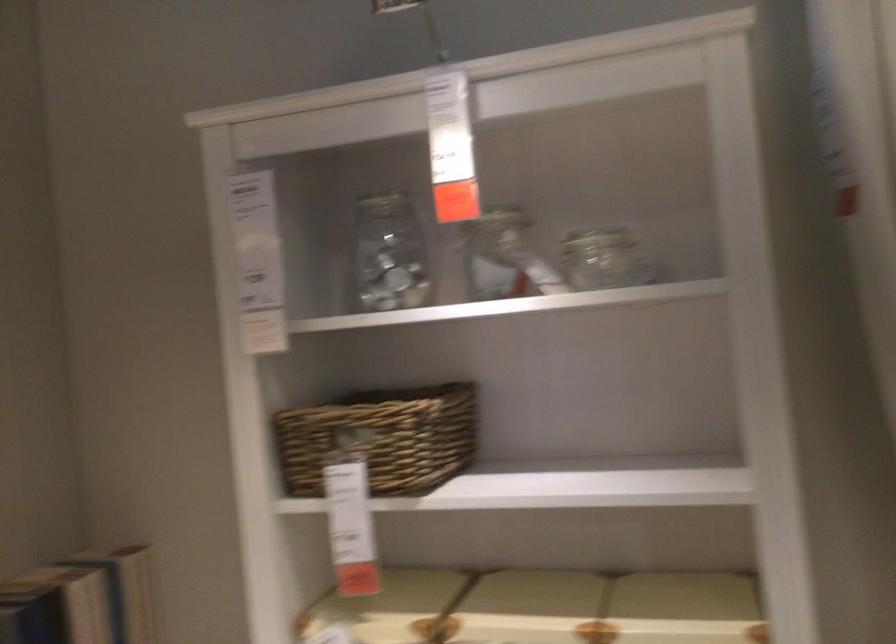
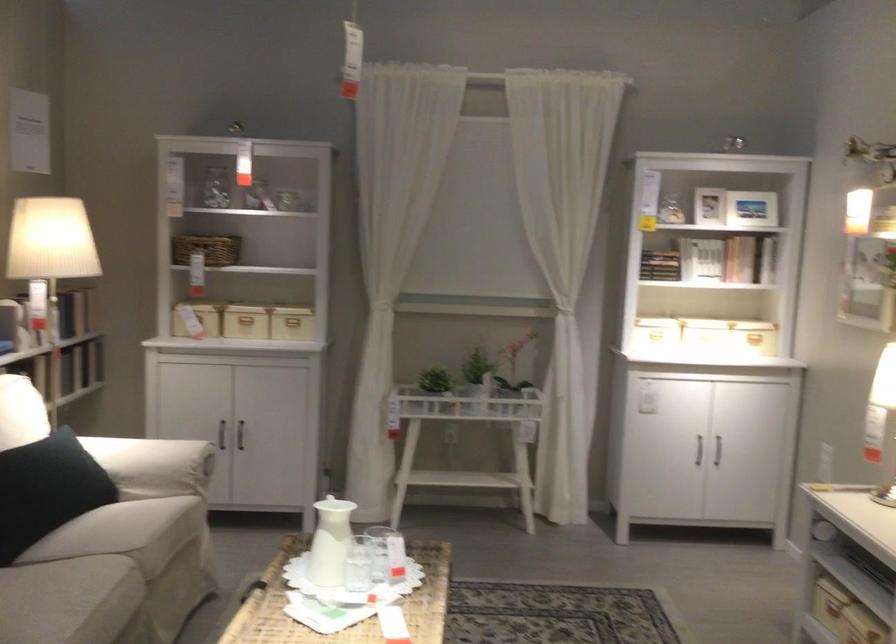
Question: I am providing you with two images of the same scene from different viewpoints. After the viewpoint changes to image2, which objects are now occluded?

Choices:
 (A) sofa sitting surface
 (B) hardcover book
 (C) dark cabinet handle
 (D) none of these

Answer: (D)